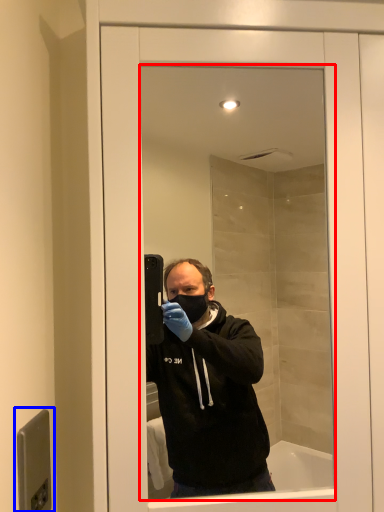
Question: Among these objects, which one is farthest to the camera, mirror (highlighted by a red box) or door handle (highlighted by a blue box)?

Choices:
 (A) mirror
 (B) door handle

Answer: (A)